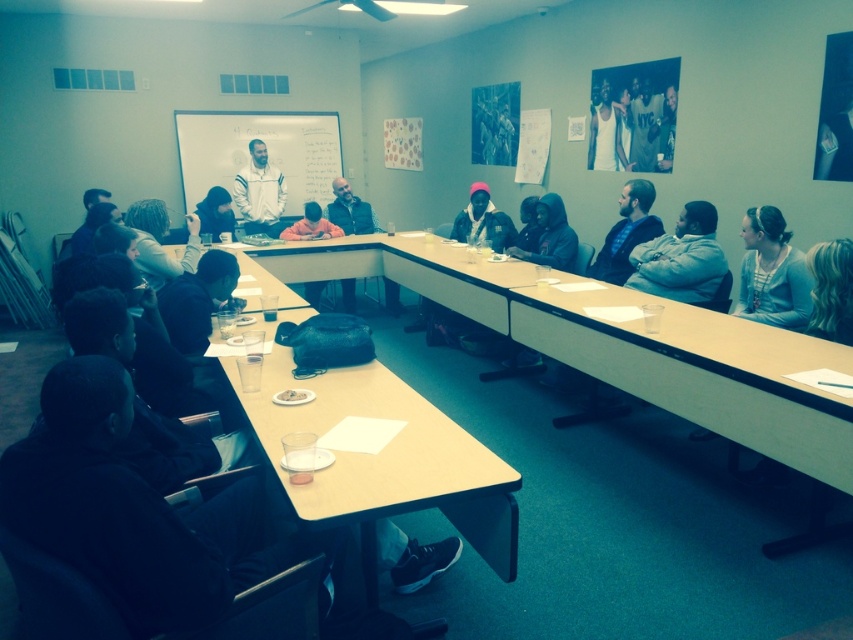
Based on the photo, you are organizing a small workshop and need to seat 10 participants. The light brown wood table at center can accommodate 8 people comfortably. Considering the size of the table and the presence of the blonde hair at upper right, can you fit all 10 participants at the table?

The light brown wood table at center is larger in size than blonde hair at upper right, but the table can only accommodate 8 people. Therefore, it cannot fit all 10 participants comfortably.